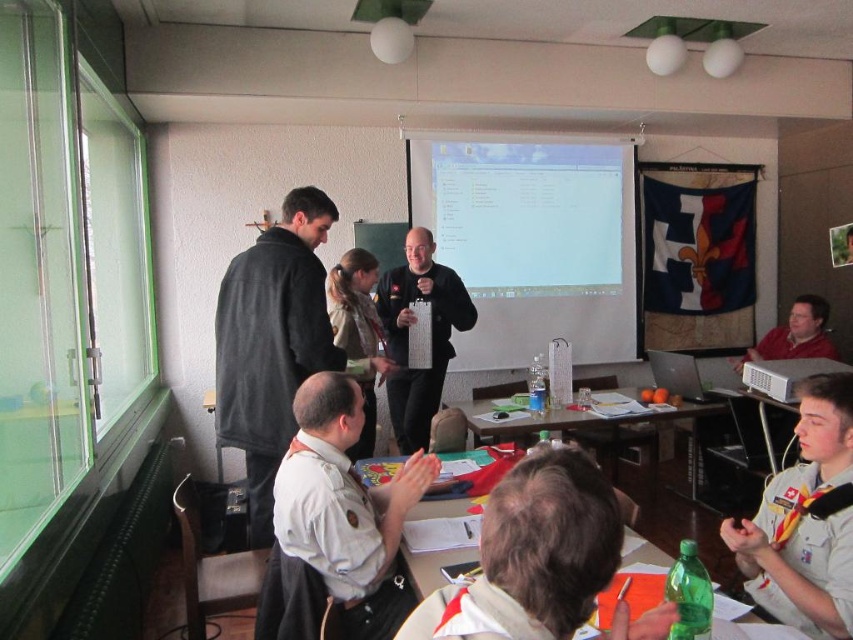
Question: Which point is farther from the camera taking this photo?

Choices:
 (A) (276, 330)
 (B) (585, 566)
 (C) (486, 435)
 (D) (799, 540)

Answer: (C)

Question: Is dark gray fleece jacket at upper left above matte plastic table at center?

Choices:
 (A) yes
 (B) no

Answer: (A)

Question: Can you confirm if light brown uniform at center is positioned to the left of white uniform shirt at lower right?

Choices:
 (A) yes
 (B) no

Answer: (A)

Question: Is light brown uniform at center positioned at the back of wooden table at center?

Choices:
 (A) no
 (B) yes

Answer: (A)

Question: Which object is farther from the camera taking this photo?

Choices:
 (A) dark gray fleece jacket at upper left
 (B) matte plastic table at center

Answer: (A)

Question: Which point is farther to the camera?

Choices:
 (A) matte plastic table at center
 (B) dark gray fleece jacket at upper left

Answer: (B)